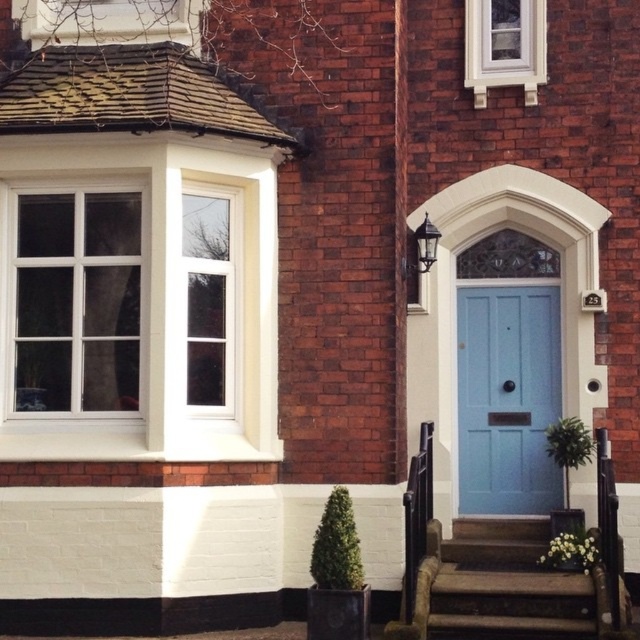
Question: Is white glass window at upper left positioned in front of clear glass window at upper left?

Choices:
 (A) yes
 (B) no

Answer: (A)

Question: From the image, what is the correct spatial relationship of white glass window at upper left in relation to light blue wooden door at center?

Choices:
 (A) below
 (B) above

Answer: (B)

Question: Considering the real-world distances, which object is closest to the white glass window at upper left?

Choices:
 (A) smooth stone stairs at center
 (B) light blue wooden door at center
 (C) clear glass window at upper left

Answer: (C)

Question: Which of the following is the closest to the observer?

Choices:
 (A) (512, 352)
 (B) (120, 289)

Answer: (B)

Question: Based on their relative distances, which object is farther from the smooth stone stairs at center?

Choices:
 (A) white painted wood window at upper center
 (B) clear glass window at upper left
 (C) white glass window at upper left

Answer: (A)

Question: Does light blue wooden door at center come behind white painted wood window at upper center?

Choices:
 (A) no
 (B) yes

Answer: (B)